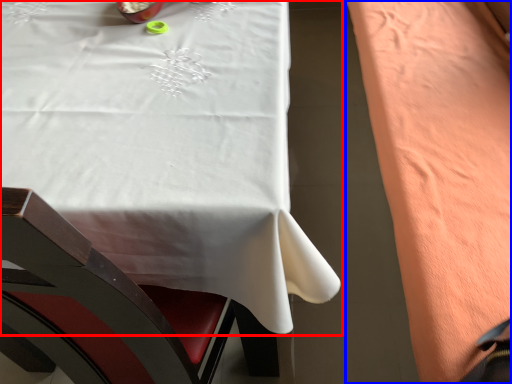
Question: Among these objects, which one is nearest to the camera, table (highlighted by a red box) or blanket (highlighted by a blue box)?

Choices:
 (A) table
 (B) blanket

Answer: (A)